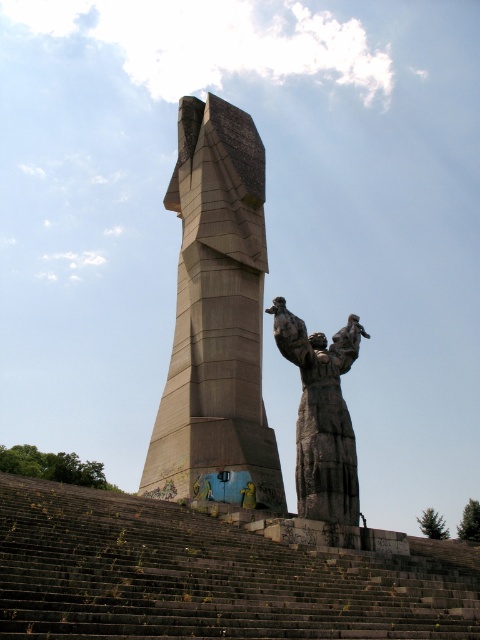
Can you confirm if dark gray stone stairs at center is smaller than rough stone statue at center?

Actually, dark gray stone stairs at center might be larger than rough stone statue at center.

Which of these two, dark gray stone stairs at center or rough stone statue at center, stands taller?

rough stone statue at center

Is point (230, 628) more distant than point (303, 442)?

No, it is not.

This screenshot has height=640, width=480. I want to click on dark gray stone stairs at center, so click(207, 577).

Is point (12, 582) positioned in front of point (175, 349)?

Yes.

Who is lower down, dark gray stone stairs at center or gray stone statue at center?

dark gray stone stairs at center is lower down.

Describe the element at coordinates (207, 577) in the screenshot. The image size is (480, 640). I see `dark gray stone stairs at center` at that location.

At what (x,y) coordinates should I click in order to perform the action: click on dark gray stone stairs at center. Please return your answer as a coordinate pair (x, y). This screenshot has width=480, height=640. Looking at the image, I should click on (207, 577).

From the picture: Is gray stone statue at center closer to the viewer compared to rough stone statue at center?

No, it is behind rough stone statue at center.

Does point (204, 401) lie behind point (323, 339)?

Yes, it is behind point (323, 339).

Identify the location of gray stone statue at center. The image size is (480, 640). (216, 314).